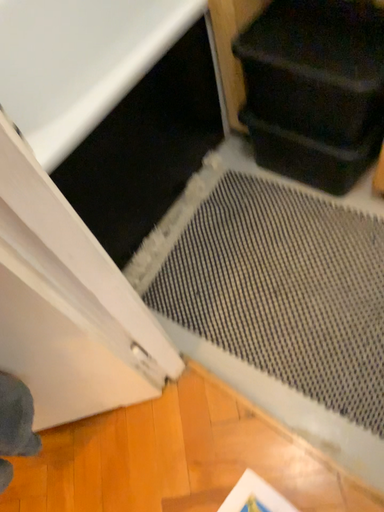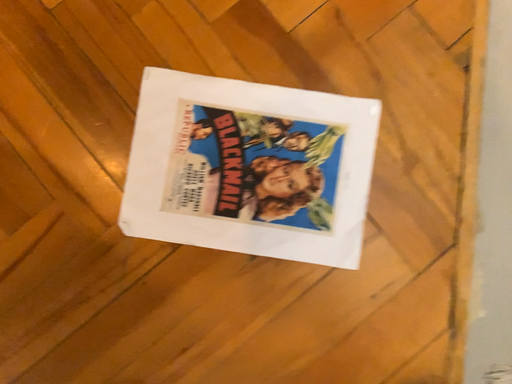
Question: How did the camera likely rotate when shooting the video?

Choices:
 (A) rotated downward
 (B) rotated upward

Answer: (A)